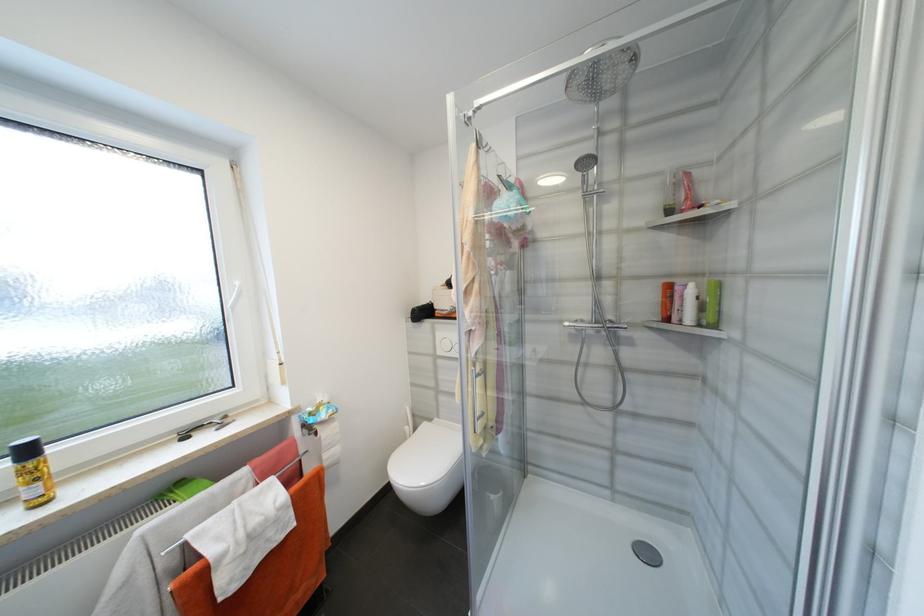
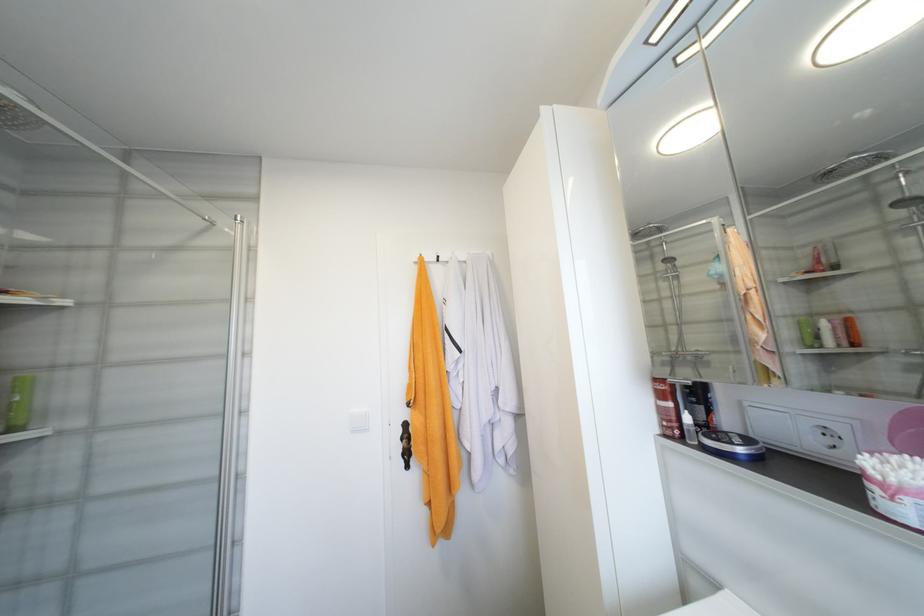
In the second image, find the point that corresponds to the point at 721,326 in the first image.

(19, 430)